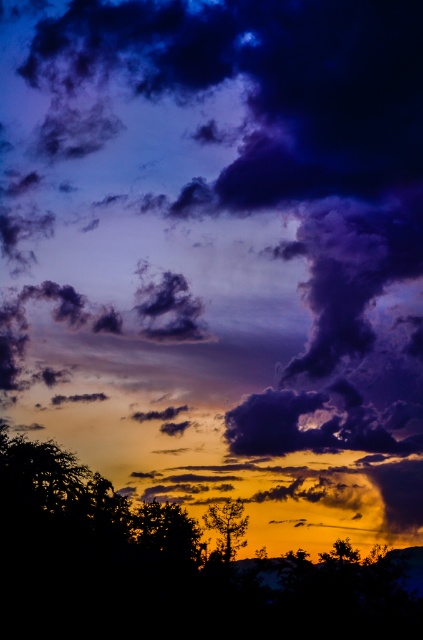
Consider the image. Does silvery metallic tree at center have a greater width compared to silky black tree at lower right?

Incorrect, silvery metallic tree at center's width does not surpass silky black tree at lower right's.

Describe the element at coordinates (227, 528) in the screenshot. This screenshot has width=423, height=640. I see `silvery metallic tree at center` at that location.

At what (x,y) coordinates should I click in order to perform the action: click on silvery metallic tree at center. Please return your answer as a coordinate pair (x, y). The height and width of the screenshot is (640, 423). Looking at the image, I should click on (227, 528).

Who is more forward, (44, 589) or (219, 538)?

Point (44, 589) is more forward.

Between silhouette leafy tree at lower center and silvery metallic tree at center, which one is positioned lower?

silhouette leafy tree at lower center

Which is in front, point (145, 515) or point (216, 506)?

Point (145, 515) is more forward.

This screenshot has width=423, height=640. I want to click on silhouette leafy tree at lower center, so click(164, 570).

Which is more to the left, silhouette leafy tree at lower center or silky black tree at lower right?

silhouette leafy tree at lower center

Is silhouette leafy tree at lower center further to the viewer compared to silky black tree at lower right?

No, it is not.

In the scene shown: Who is more distant from viewer, (65, 493) or (321, 556)?

Point (321, 556)

I want to click on silhouette leafy tree at lower center, so click(164, 570).